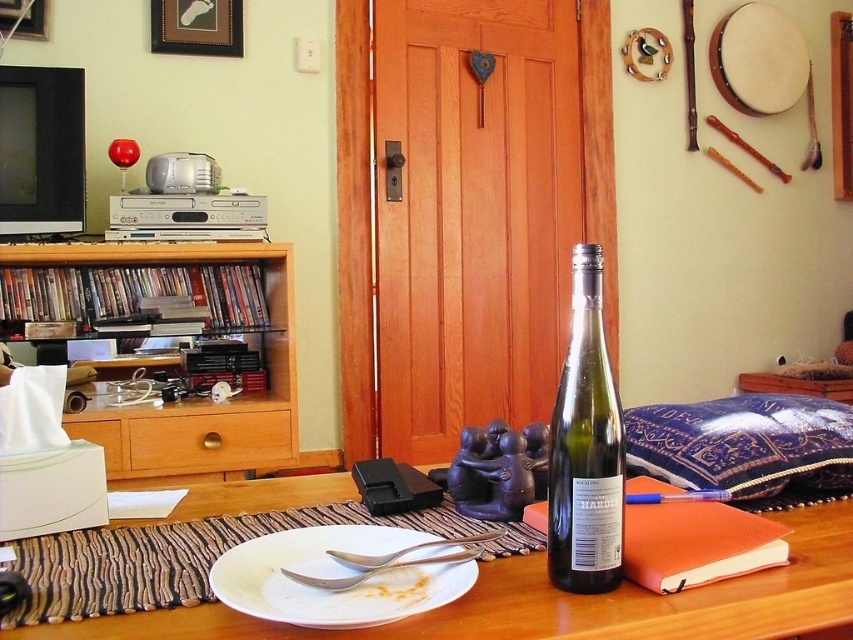
Is green glass bottle at center smaller than brushed metal picture frame at upper left?

No, green glass bottle at center is not smaller than brushed metal picture frame at upper left.

Consider the image. Measure the distance between point (589, 285) and camera.

Point (589, 285) is 25.15 inches away from camera.

Find the location of a particular element. Image resolution: width=853 pixels, height=640 pixels. green glass bottle at center is located at coordinates (585, 445).

Who is more forward, (157, 435) or (595, 550)?

Point (595, 550)

Between point (45, 246) and point (566, 470), which one is positioned behind?

Positioned behind is point (45, 246).

Between point (273, 369) and point (605, 442), which one is positioned behind?

The point (273, 369) is behind.

Locate an element on the screen. woodenmaterial/texturedvd cabinet at left is located at coordinates (202, 400).

Does white glossy plate at center have a larger size compared to satin silver spoon at center?

Yes, white glossy plate at center is bigger than satin silver spoon at center.

Is white glossy plate at center closer to camera compared to satin silver spoon at center?

Yes, white glossy plate at center is closer to the viewer.

Locate an element on the screen. The height and width of the screenshot is (640, 853). white glossy plate at center is located at coordinates (334, 577).